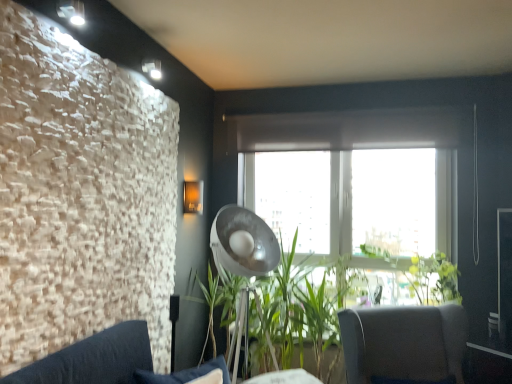
Question: Is dark gray fabric couch at lower left at the back of green leafy plant at center?

Choices:
 (A) no
 (B) yes

Answer: (A)

Question: Does green leafy plant at center come behind dark gray fabric couch at lower left?

Choices:
 (A) no
 (B) yes

Answer: (B)

Question: Does green leafy plant at center have a smaller size compared to dark gray fabric couch at lower left?

Choices:
 (A) yes
 (B) no

Answer: (B)

Question: From the image's perspective, is green leafy plant at center on top of dark gray fabric couch at lower left?

Choices:
 (A) yes
 (B) no

Answer: (B)

Question: Is green leafy plant at center positioned beyond the bounds of dark gray fabric couch at lower left?

Choices:
 (A) no
 (B) yes

Answer: (B)

Question: Is green leafy plant at center wider or thinner than dark gray fabric couch at lower left?

Choices:
 (A) thin
 (B) wide

Answer: (B)

Question: Is green leafy plant at center in front of or behind dark gray fabric couch at lower left in the image?

Choices:
 (A) behind
 (B) front

Answer: (A)

Question: Do you think green leafy plant at center is within dark gray fabric couch at lower left, or outside of it?

Choices:
 (A) inside
 (B) outside

Answer: (B)

Question: Considering the positions of green leafy plant at center and dark gray fabric couch at lower left in the image, is green leafy plant at center bigger or smaller than dark gray fabric couch at lower left?

Choices:
 (A) small
 (B) big

Answer: (B)

Question: Is point (126, 337) positioned closer to the camera than point (220, 233)?

Choices:
 (A) closer
 (B) farther

Answer: (A)

Question: Is dark gray fabric couch at lower left wider or thinner than metallic silver lamp at center?

Choices:
 (A) thin
 (B) wide

Answer: (A)

Question: From a real-world perspective, relative to metallic silver lamp at center, is dark gray fabric couch at lower left vertically above or below?

Choices:
 (A) below
 (B) above

Answer: (A)

Question: From the image's perspective, is dark gray fabric couch at lower left positioned above or below metallic silver lamp at center?

Choices:
 (A) above
 (B) below

Answer: (B)

Question: Is metallic silver lamp at center to the left or to the right of dark gray fabric couch at lower left in the image?

Choices:
 (A) right
 (B) left

Answer: (A)

Question: In the image, is metallic silver lamp at center positioned in front of or behind dark gray fabric couch at lower left?

Choices:
 (A) front
 (B) behind

Answer: (B)